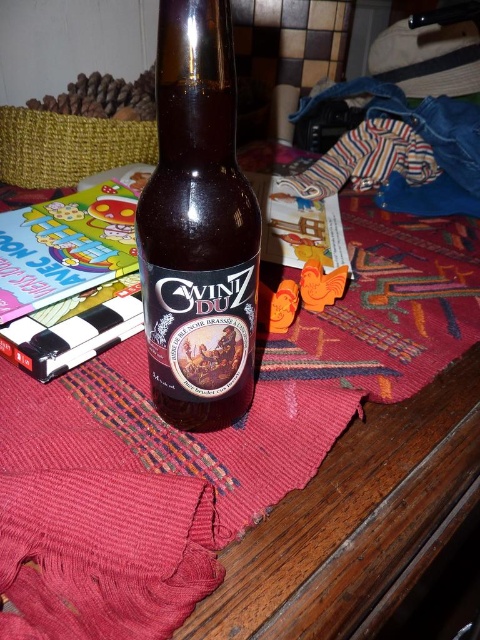
Who is higher up, brown glass bottle at center or hardcover book at center-left?

hardcover book at center-left

Where is `brown glass bottle at center`? This screenshot has height=640, width=480. brown glass bottle at center is located at coordinates (197, 227).